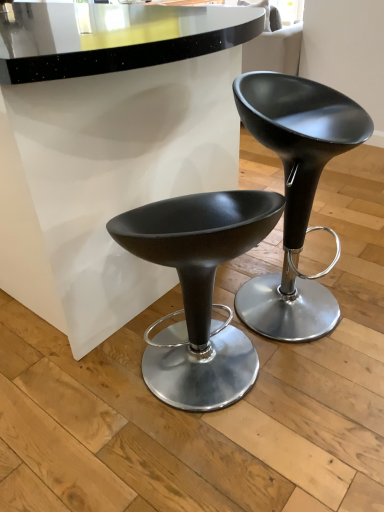
This screenshot has width=384, height=512. What do you see at coordinates (296, 193) in the screenshot?
I see `matte black stool at center, positioned as the 2th stool in left-to-right order` at bounding box center [296, 193].

Identify the location of matte black stool at center, which is the 1th stool in right-to-left order. The image size is (384, 512). (296, 193).

Locate an element on the screen. Image resolution: width=384 pixels, height=512 pixels. matte black stool at center, the 2th stool when ordered from right to left is located at coordinates (199, 291).

What do you see at coordinates (199, 291) in the screenshot?
I see `matte black stool at center, the 2th stool when ordered from right to left` at bounding box center [199, 291].

In order to face matte black stool at center, the first stool when ordered from left to right, should I rotate leftwards or rightwards?

Turn right approximately 0.460 degrees to face it.

You are a GUI agent. You are given a task and a screenshot of the screen. Output one action in this format:
    pyautogui.click(x=<x>, y=<y>)
    Task: Click on the matte black stool at center, positioned as the 2th stool in left-to-right order
    
    Given the screenshot: What is the action you would take?
    pyautogui.click(x=296, y=193)

Considering the positions of objects matte black stool at center, the 2th stool when ordered from right to left, and matte black stool at center, which is the 1th stool in right-to-left order, in the image provided, who is more to the right, matte black stool at center, the 2th stool when ordered from right to left, or matte black stool at center, which is the 1th stool in right-to-left order,?

matte black stool at center, which is the 1th stool in right-to-left order.

Is the position of matte black stool at center, the first stool when ordered from left to right, more distant than that of matte black stool at center, which is the 1th stool in right-to-left order?

No.

Considering the points (212, 197) and (332, 151), which point is behind, point (212, 197) or point (332, 151)?

The point (212, 197) is behind.

From the image's perspective, does matte black stool at center, the 2th stool when ordered from right to left, appear lower than matte black stool at center, which is the 1th stool in right-to-left order?

Correct, matte black stool at center, the 2th stool when ordered from right to left, appears lower than matte black stool at center, which is the 1th stool in right-to-left order, in the image.

From a real-world perspective, which object stands above the other?

In real-world perspective, matte black stool at center, which is the 1th stool in right-to-left order, is above.

Does matte black stool at center, the first stool when ordered from left to right, have a greater width compared to matte black stool at center, which is the 1th stool in right-to-left order?

In fact, matte black stool at center, the first stool when ordered from left to right, might be narrower than matte black stool at center, which is the 1th stool in right-to-left order.

Considering the relative sizes of matte black stool at center, the first stool when ordered from left to right, and matte black stool at center, positioned as the 2th stool in left-to-right order, in the image provided, is matte black stool at center, the first stool when ordered from left to right, taller than matte black stool at center, positioned as the 2th stool in left-to-right order,?

No.

Is matte black stool at center, the first stool when ordered from left to right, bigger or smaller than matte black stool at center, positioned as the 2th stool in left-to-right order?

Result: Considering their sizes, matte black stool at center, the first stool when ordered from left to right, takes up less space than matte black stool at center, positioned as the 2th stool in left-to-right order.

Is matte black stool at center, the first stool when ordered from left to right, located outside matte black stool at center, which is the 1th stool in right-to-left order?

Indeed, matte black stool at center, the first stool when ordered from left to right, is completely outside matte black stool at center, which is the 1th stool in right-to-left order.

Are matte black stool at center, the 2th stool when ordered from right to left, and matte black stool at center, which is the 1th stool in right-to-left order, far apart?

No, there isn't a large distance between matte black stool at center, the 2th stool when ordered from right to left, and matte black stool at center, which is the 1th stool in right-to-left order.

Could you tell me if matte black stool at center, the 2th stool when ordered from right to left, is facing matte black stool at center, positioned as the 2th stool in left-to-right order?

No, matte black stool at center, the 2th stool when ordered from right to left, does not turn towards matte black stool at center, positioned as the 2th stool in left-to-right order.

The height and width of the screenshot is (512, 384). Find the location of `stool on the left of matte black stool at center, which is the 1th stool in right-to-left order`. stool on the left of matte black stool at center, which is the 1th stool in right-to-left order is located at coordinates (199, 291).

From the picture: Is matte black stool at center, positioned as the 2th stool in left-to-right order, at the right side of matte black stool at center, the first stool when ordered from left to right?

Yes.

Between matte black stool at center, which is the 1th stool in right-to-left order, and matte black stool at center, the first stool when ordered from left to right, which one is positioned behind?

matte black stool at center, which is the 1th stool in right-to-left order, is more distant.

Is point (308, 323) closer or farther from the camera than point (154, 252)?

Point (308, 323) is farther from the camera than point (154, 252).

From the image's perspective, between matte black stool at center, which is the 1th stool in right-to-left order, and matte black stool at center, the 2th stool when ordered from right to left, which one is located above?

matte black stool at center, which is the 1th stool in right-to-left order, appears higher in the image.

From a real-world perspective, which object rests below the other?

matte black stool at center, the first stool when ordered from left to right, is physically lower.

Considering the relative sizes of matte black stool at center, which is the 1th stool in right-to-left order, and matte black stool at center, the 2th stool when ordered from right to left, in the image provided, is matte black stool at center, which is the 1th stool in right-to-left order, wider than matte black stool at center, the 2th stool when ordered from right to left,?

Yes.

Which of these two, matte black stool at center, which is the 1th stool in right-to-left order, or matte black stool at center, the first stool when ordered from left to right, stands taller?

matte black stool at center, which is the 1th stool in right-to-left order.

Considering the sizes of objects matte black stool at center, which is the 1th stool in right-to-left order, and matte black stool at center, the 2th stool when ordered from right to left, in the image provided, who is smaller, matte black stool at center, which is the 1th stool in right-to-left order, or matte black stool at center, the 2th stool when ordered from right to left,?

matte black stool at center, the 2th stool when ordered from right to left.

Which is correct: matte black stool at center, which is the 1th stool in right-to-left order, is inside matte black stool at center, the first stool when ordered from left to right, or outside of it?

matte black stool at center, which is the 1th stool in right-to-left order, is outside matte black stool at center, the first stool when ordered from left to right.

Is matte black stool at center, positioned as the 2th stool in left-to-right order, not near matte black stool at center, the first stool when ordered from left to right?

They are positioned close to each other.

Is matte black stool at center, which is the 1th stool in right-to-left order, facing away from matte black stool at center, the 2th stool when ordered from right to left?

That's not correct — matte black stool at center, which is the 1th stool in right-to-left order, is not looking away from matte black stool at center, the 2th stool when ordered from right to left.

How distant is matte black stool at center, positioned as the 2th stool in left-to-right order, from matte black stool at center, the 2th stool when ordered from right to left?

matte black stool at center, positioned as the 2th stool in left-to-right order, and matte black stool at center, the 2th stool when ordered from right to left, are 10.43 inches apart from each other.

The image size is (384, 512). Identify the location of stool lying above the matte black stool at center, the 2th stool when ordered from right to left (from the image's perspective). (296, 193).

I want to click on stool that appears on the left of matte black stool at center, which is the 1th stool in right-to-left order, so pyautogui.click(x=199, y=291).

Where is `stool in front of the matte black stool at center, positioned as the 2th stool in left-to-right order`? stool in front of the matte black stool at center, positioned as the 2th stool in left-to-right order is located at coordinates (199, 291).